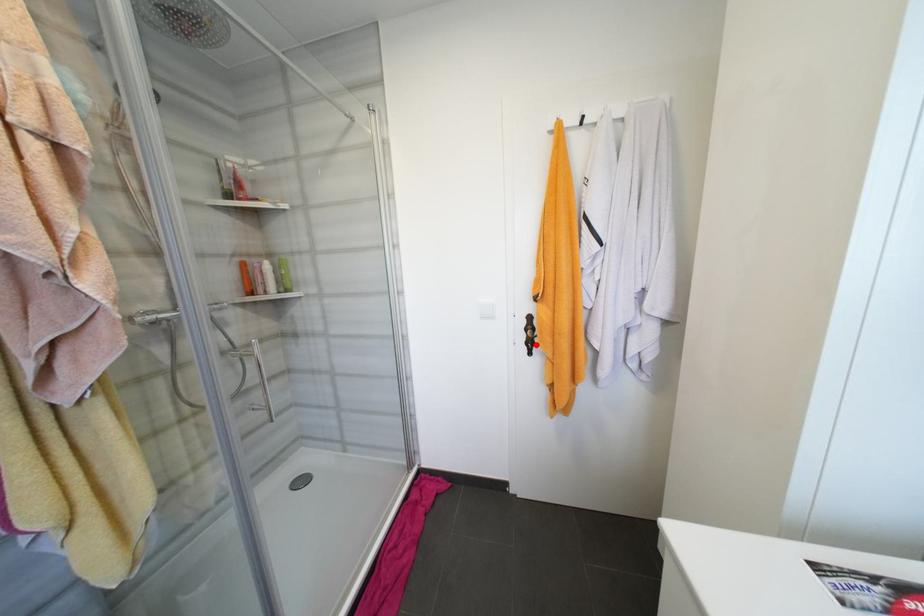
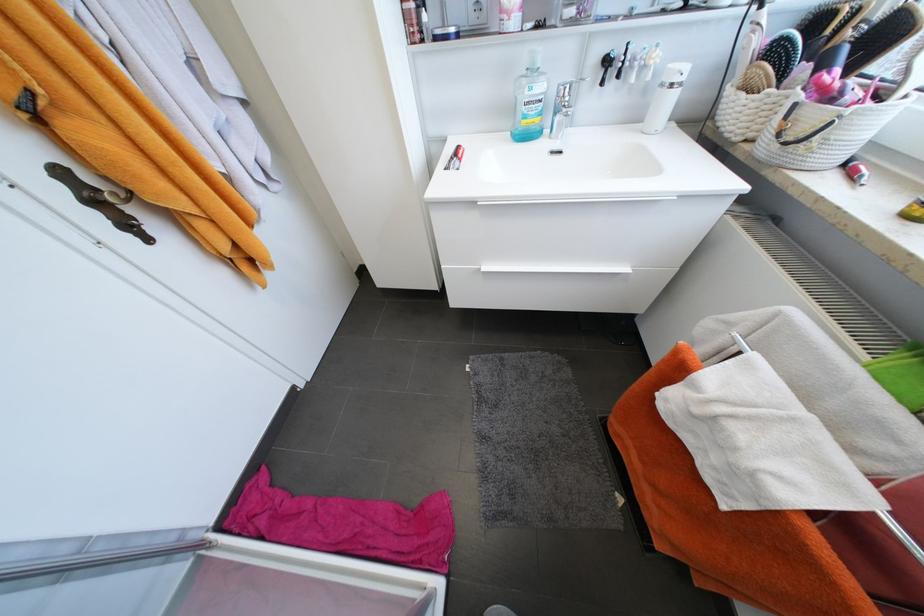
Where in the second image is the point corresponding to the highlighted location from the first image?

(132, 225)